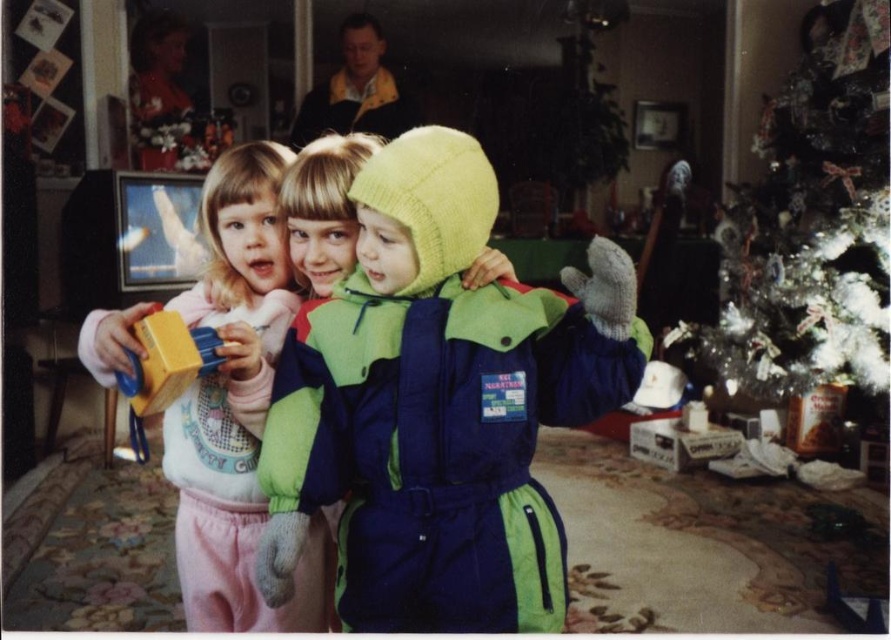
Question: Which object appears farthest from the camera in this image?

Choices:
 (A) white glittery christmas tree at upper right
 (B) matte pink pants at center

Answer: (A)

Question: Can you confirm if white glittery christmas tree at upper right is positioned to the right of matte pink pants at center?

Choices:
 (A) yes
 (B) no

Answer: (A)

Question: Does multicolored fleece snowsuit at center appear on the left side of matte pink pants at center?

Choices:
 (A) yes
 (B) no

Answer: (B)

Question: Which point is closer to the camera taking this photo?

Choices:
 (A) (128, 352)
 (B) (251, 218)

Answer: (A)

Question: Is multicolored fleece snowsuit at center smaller than matte pink pants at center?

Choices:
 (A) no
 (B) yes

Answer: (B)

Question: Which of the following is the farthest from the observer?

Choices:
 (A) matte pink pants at center
 (B) multicolored fleece snowsuit at center
 (C) matte yellow block at center
 (D) white glittery christmas tree at upper right

Answer: (D)